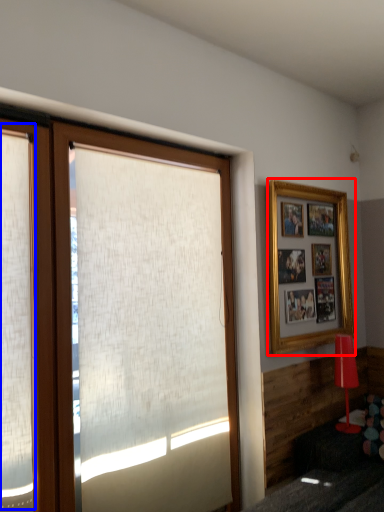
Question: Which of the following is the farthest to the observer, picture frame (highlighted by a red box) or shutter (highlighted by a blue box)?

Choices:
 (A) picture frame
 (B) shutter

Answer: (A)